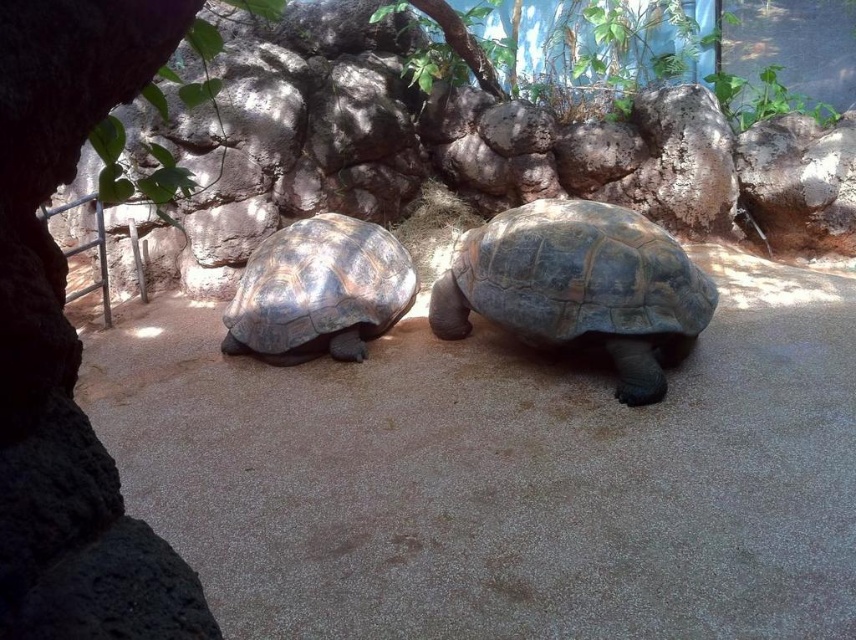
Is rough textured tortoise at center to the left of dark brown textured shell at center from the viewer's perspective?

No, rough textured tortoise at center is not to the left of dark brown textured shell at center.

Does rough textured tortoise at center have a greater width compared to dark brown textured shell at center?

Yes.

The width and height of the screenshot is (856, 640). In order to click on rough textured tortoise at center in this screenshot , I will do `click(580, 285)`.